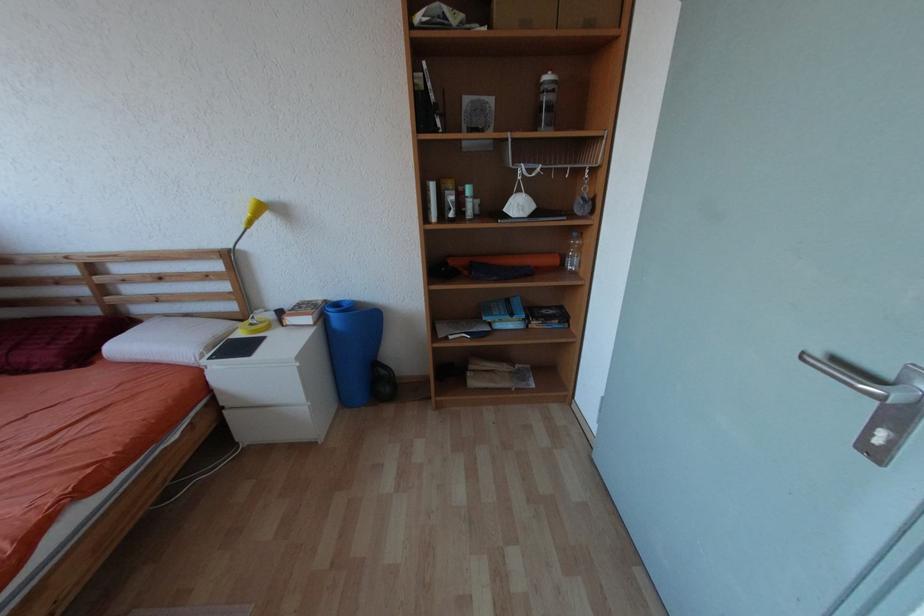
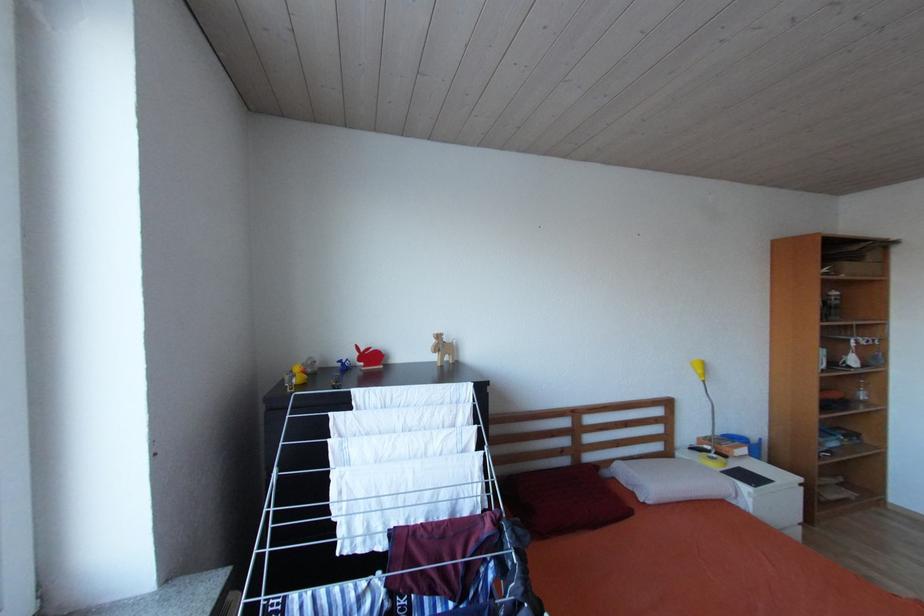
Question: In a continuous first-person perspective shot, in which direction is the camera moving?

Choices:
 (A) Left
 (B) Right
 (C) Forward
 (D) Backward

Answer: (A)